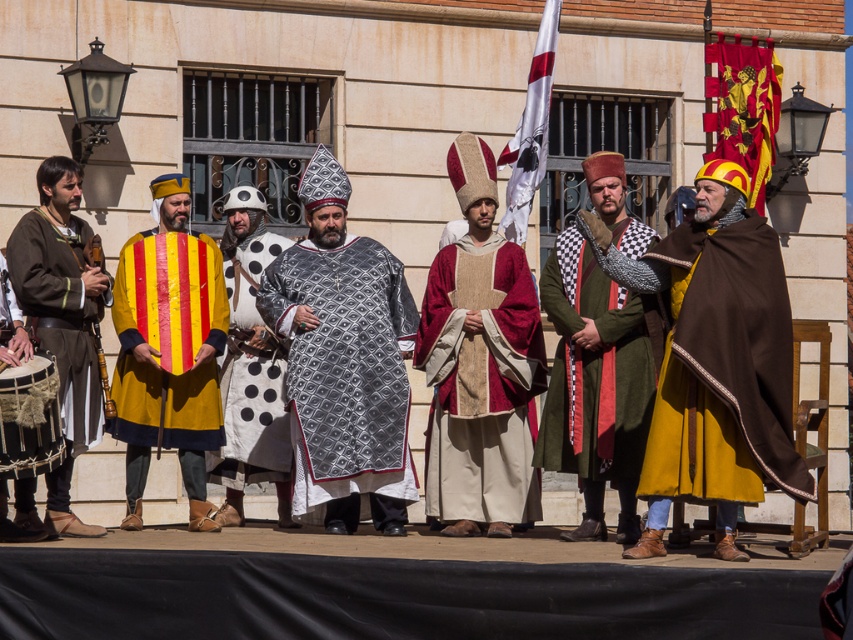
Question: Which point is closer to the camera?

Choices:
 (A) (73, 186)
 (B) (575, 472)

Answer: (A)

Question: Does brown leather tunic at left appear under white fabric flag at center?

Choices:
 (A) no
 (B) yes

Answer: (B)

Question: Is brown woolen cape at center in front of wooden flute at left?

Choices:
 (A) yes
 (B) no

Answer: (A)

Question: Observing the image, what is the correct spatial positioning of silver metallic shield at center in reference to red velvet banner at upper right?

Choices:
 (A) right
 (B) left

Answer: (B)

Question: Which object is farther from the camera taking this photo?

Choices:
 (A) yellowstriped fabricshield at left
 (B) red velvet banner at upper right
 (C) brown leather tunic at left
 (D) white fabric flag at center

Answer: (B)

Question: Which object is closer to the camera taking this photo?

Choices:
 (A) green woolen robe at center
 (B) white dotted fabric at center

Answer: (A)